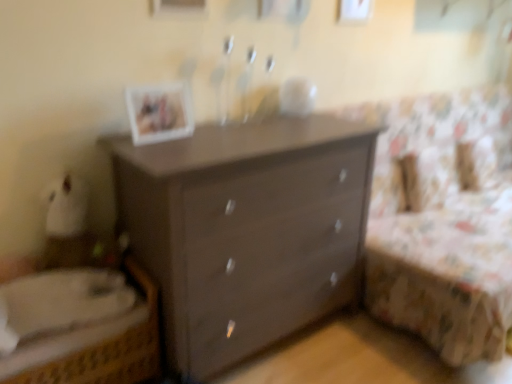
Question: Would you consider matte brown dresser at center to be distant from floral fabric bed at right?

Choices:
 (A) yes
 (B) no

Answer: (B)

Question: From a real-world perspective, is matte brown dresser at center physically below floral fabric bed at right?

Choices:
 (A) no
 (B) yes

Answer: (B)

Question: Is the depth of matte brown dresser at center less than that of floral fabric bed at right?

Choices:
 (A) no
 (B) yes

Answer: (B)

Question: Is matte brown dresser at center at the right side of floral fabric bed at right?

Choices:
 (A) yes
 (B) no

Answer: (B)

Question: Considering the relative sizes of matte brown dresser at center and floral fabric bed at right in the image provided, is matte brown dresser at center smaller than floral fabric bed at right?

Choices:
 (A) no
 (B) yes

Answer: (B)

Question: Visually, is matte brown dresser at center positioned to the left or to the right of matte white picture frame at upper center?

Choices:
 (A) right
 (B) left

Answer: (A)

Question: Looking at the image, does matte brown dresser at center seem bigger or smaller compared to matte white picture frame at upper center?

Choices:
 (A) small
 (B) big

Answer: (B)

Question: Is matte brown dresser at center wider or thinner than matte white picture frame at upper center?

Choices:
 (A) thin
 (B) wide

Answer: (B)

Question: From the image's perspective, relative to matte white picture frame at upper center, is matte brown dresser at center above or below?

Choices:
 (A) above
 (B) below

Answer: (B)

Question: Considering the relative positions of woven wicker bed at lower left and matte white picture frame at upper center in the image provided, is woven wicker bed at lower left to the left or to the right of matte white picture frame at upper center?

Choices:
 (A) left
 (B) right

Answer: (A)

Question: Which is correct: woven wicker bed at lower left is inside matte white picture frame at upper center, or outside of it?

Choices:
 (A) inside
 (B) outside

Answer: (B)

Question: Relative to matte white picture frame at upper center, is woven wicker bed at lower left in front or behind?

Choices:
 (A) front
 (B) behind

Answer: (A)

Question: From a real-world perspective, is woven wicker bed at lower left physically located above or below matte white picture frame at upper center?

Choices:
 (A) below
 (B) above

Answer: (A)

Question: From a real-world perspective, is woven wicker bed at lower left physically located above or below matte brown dresser at center?

Choices:
 (A) below
 (B) above

Answer: (A)

Question: Is woven wicker bed at lower left spatially inside matte brown dresser at center, or outside of it?

Choices:
 (A) inside
 (B) outside

Answer: (B)